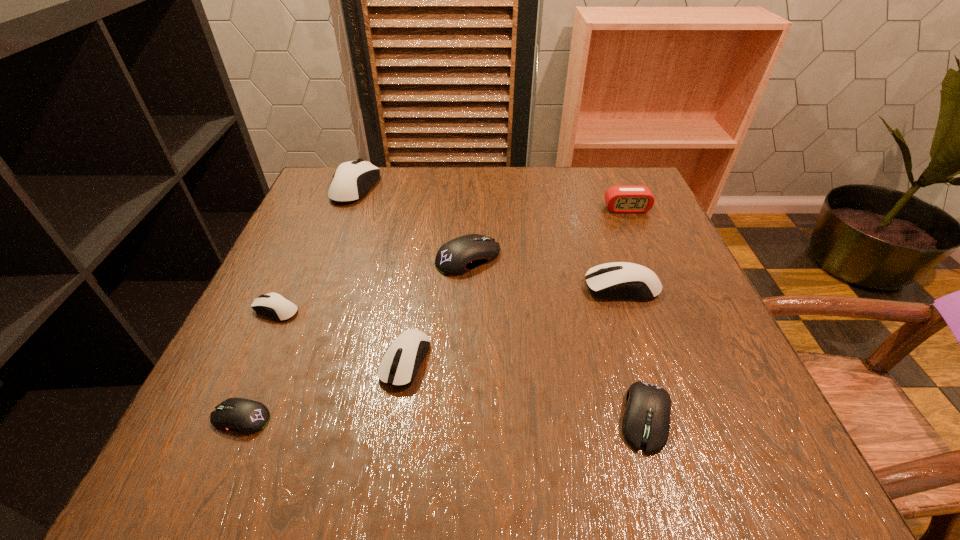
Where is `the farthest white mouse`? the farthest white mouse is located at coordinates (352, 180).

Identify the location of the biggest white mouse. Image resolution: width=960 pixels, height=540 pixels. (352, 180).

Locate an element on the screen. alarm clock is located at coordinates (619, 199).

Find the location of a particular element. the second biggest white mouse is located at coordinates [x=624, y=280].

Locate an element on the screen. The image size is (960, 540). the farthest black computer equipment is located at coordinates (458, 256).

Find the location of a particular element. The width and height of the screenshot is (960, 540). the biggest black computer equipment is located at coordinates (458, 256).

The image size is (960, 540). Identify the location of the third biggest white mouse. (405, 354).

Image resolution: width=960 pixels, height=540 pixels. I want to click on the second white mouse from right to left, so click(x=405, y=354).

Locate an element on the screen. Image resolution: width=960 pixels, height=540 pixels. the second smallest black computer equipment is located at coordinates (646, 422).

Where is `the smallest white mouse`? the smallest white mouse is located at coordinates (274, 305).